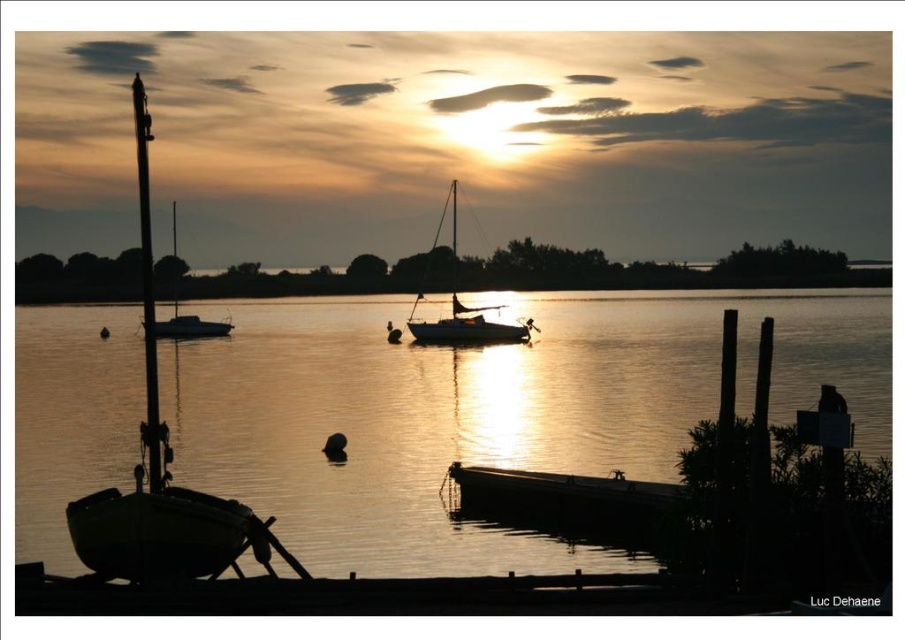
The image size is (905, 640). What do you see at coordinates (488, 410) in the screenshot? I see `silvery water at boat left` at bounding box center [488, 410].

Is silvery water at boat left shorter than white glossy sailboat at center?

Indeed, silvery water at boat left has a lesser height compared to white glossy sailboat at center.

Does point (395, 532) come farther from viewer compared to point (427, 323)?

No, it is not.

I want to click on silvery water at boat left, so click(488, 410).

This screenshot has width=905, height=640. Find the location of `green matte sailboat at left`. green matte sailboat at left is located at coordinates (159, 468).

Who is higher up, green matte sailboat at left or silhouette sailboat at center?

silhouette sailboat at center

You are a GUI agent. You are given a task and a screenshot of the screen. Output one action in this format:
    pyautogui.click(x=<x>, y=<y>)
    Task: Click on the green matte sailboat at left
    
    Given the screenshot: What is the action you would take?
    point(159,468)

In order to click on green matte sailboat at left in this screenshot , I will do `click(159, 468)`.

Between silvery water at boat left and silhouette sailboat at center, which one is positioned lower?

silvery water at boat left is lower down.

Is silvery water at boat left to the right of silhouette sailboat at center from the viewer's perspective?

Correct, you'll find silvery water at boat left to the right of silhouette sailboat at center.

Who is more forward, (593,440) or (157,321)?

Point (593,440)

Find the location of a particular element. This screenshot has width=905, height=640. silvery water at boat left is located at coordinates (488, 410).